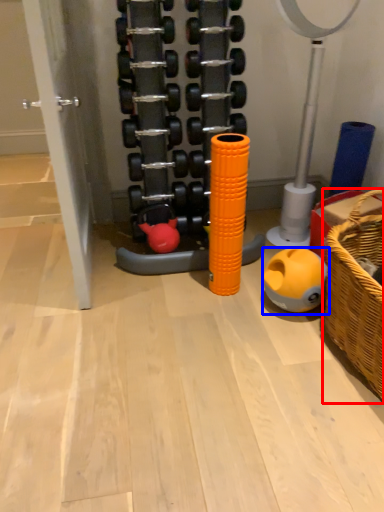
Question: Which of the following is the farthest to the observer, basket (highlighted by a red box) or toy (highlighted by a blue box)?

Choices:
 (A) basket
 (B) toy

Answer: (B)